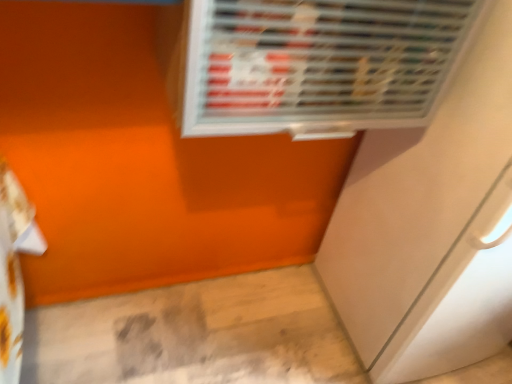
The image size is (512, 384). What do you see at coordinates (320, 64) in the screenshot?
I see `metallic silver air conditioning at upper center` at bounding box center [320, 64].

Find the location of `metallic silver air conditioning at upper center`. metallic silver air conditioning at upper center is located at coordinates (320, 64).

Find the location of a particular element. white glossy screen door at lower right is located at coordinates (431, 227).

The image size is (512, 384). Describe the element at coordinates (431, 227) in the screenshot. I see `white glossy screen door at lower right` at that location.

Locate an element on the screen. metallic silver air conditioning at upper center is located at coordinates (320, 64).

Can you confirm if white glossy screen door at lower right is positioned to the left of metallic silver air conditioning at upper center?

No.

Is white glossy screen door at lower right in front of metallic silver air conditioning at upper center?

No, it is behind metallic silver air conditioning at upper center.

Does point (370, 292) appear closer or farther from the camera than point (221, 103)?

Point (370, 292) is farther from the camera than point (221, 103).

From the image's perspective, is white glossy screen door at lower right located above metallic silver air conditioning at upper center?

No, from the image's perspective, white glossy screen door at lower right is not above metallic silver air conditioning at upper center.

From a real-world perspective, between white glossy screen door at lower right and metallic silver air conditioning at upper center, who is vertically lower?

From a 3D spatial view, white glossy screen door at lower right is below.

Which object is thinner, white glossy screen door at lower right or metallic silver air conditioning at upper center?

With smaller width is metallic silver air conditioning at upper center.

Considering the sizes of objects white glossy screen door at lower right and metallic silver air conditioning at upper center in the image provided, who is taller, white glossy screen door at lower right or metallic silver air conditioning at upper center?

With more height is white glossy screen door at lower right.

Considering the sizes of objects white glossy screen door at lower right and metallic silver air conditioning at upper center in the image provided, who is smaller, white glossy screen door at lower right or metallic silver air conditioning at upper center?

With smaller size is metallic silver air conditioning at upper center.

Which is correct: white glossy screen door at lower right is inside metallic silver air conditioning at upper center, or outside of it?

white glossy screen door at lower right is outside metallic silver air conditioning at upper center.

Is white glossy screen door at lower right not close to metallic silver air conditioning at upper center?

They are positioned close to each other.

Does white glossy screen door at lower right turn towards metallic silver air conditioning at upper center?

No, white glossy screen door at lower right is not facing towards metallic silver air conditioning at upper center.

How different are the orientations of white glossy screen door at lower right and metallic silver air conditioning at upper center in degrees?

The angular difference between white glossy screen door at lower right and metallic silver air conditioning at upper center is 1.62 degrees.

This screenshot has height=384, width=512. Identify the location of screen door on the right of metallic silver air conditioning at upper center. (431, 227).

Is metallic silver air conditioning at upper center at the left side of white glossy screen door at lower right?

Yes.

Which is in front, metallic silver air conditioning at upper center or white glossy screen door at lower right?

metallic silver air conditioning at upper center is closer to the camera.

Is point (205, 108) farther from viewer compared to point (442, 288)?

No, (205, 108) is closer to viewer.

From the image's perspective, is metallic silver air conditioning at upper center below white glossy screen door at lower right?

Incorrect, from the image's perspective, metallic silver air conditioning at upper center is higher than white glossy screen door at lower right.

From a real-world perspective, is metallic silver air conditioning at upper center on top of white glossy screen door at lower right?

Correct, in the physical world, metallic silver air conditioning at upper center is higher than white glossy screen door at lower right.

Which object is wider, metallic silver air conditioning at upper center or white glossy screen door at lower right?

white glossy screen door at lower right.

Is metallic silver air conditioning at upper center taller or shorter than white glossy screen door at lower right?

Considering their sizes, metallic silver air conditioning at upper center has less height than white glossy screen door at lower right.

In terms of size, does metallic silver air conditioning at upper center appear bigger or smaller than white glossy screen door at lower right?

Clearly, metallic silver air conditioning at upper center is smaller in size than white glossy screen door at lower right.

Is metallic silver air conditioning at upper center surrounding white glossy screen door at lower right?

Definitely not — white glossy screen door at lower right is not inside metallic silver air conditioning at upper center.

Are metallic silver air conditioning at upper center and white glossy screen door at lower right beside each other?

No.

Could you tell me if metallic silver air conditioning at upper center is turned towards white glossy screen door at lower right?

No, metallic silver air conditioning at upper center is not oriented towards white glossy screen door at lower right.

What are the coordinates of `air conditioning lying in front of the white glossy screen door at lower right` in the screenshot? It's located at (320, 64).

Where is `air conditioning in front of the white glossy screen door at lower right`? air conditioning in front of the white glossy screen door at lower right is located at coordinates (320, 64).

The width and height of the screenshot is (512, 384). Find the location of `air conditioning above the white glossy screen door at lower right (from a real-world perspective)`. air conditioning above the white glossy screen door at lower right (from a real-world perspective) is located at coordinates (320, 64).